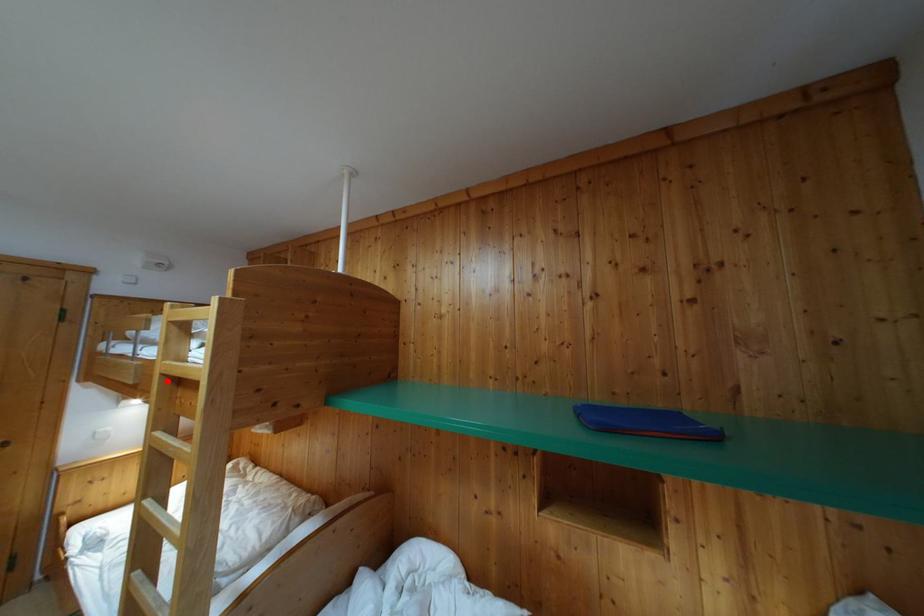
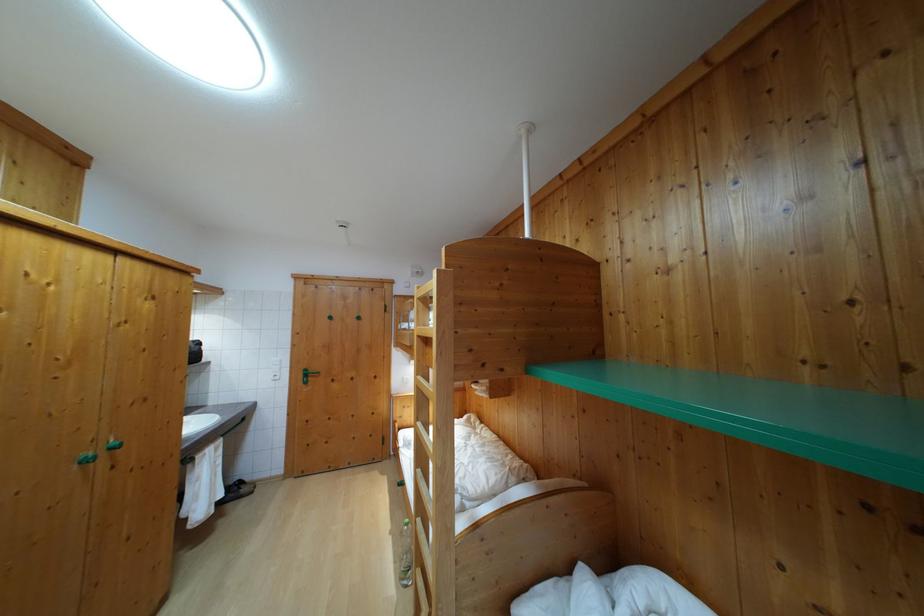
The point at the highlighted location is marked in the first image. Where is the corresponding point in the second image?

(421, 342)